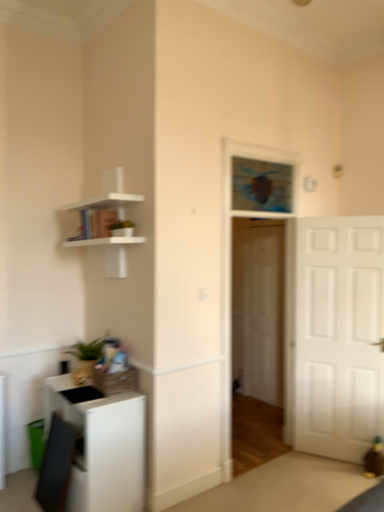
Question: Does white matte shelf at upper left have a lesser height compared to blue glass window at center?

Choices:
 (A) no
 (B) yes

Answer: (A)

Question: From the image's perspective, is white matte shelf at upper left under blue glass window at center?

Choices:
 (A) no
 (B) yes

Answer: (B)

Question: Does white matte shelf at upper left have a lesser width compared to blue glass window at center?

Choices:
 (A) no
 (B) yes

Answer: (A)

Question: Is blue glass window at center inside white matte shelf at upper left?

Choices:
 (A) yes
 (B) no

Answer: (B)

Question: Is white matte shelf at upper left looking in the opposite direction of blue glass window at center?

Choices:
 (A) yes
 (B) no

Answer: (A)

Question: Is point (347, 237) closer or farther from the camera than point (276, 378)?

Choices:
 (A) closer
 (B) farther

Answer: (A)

Question: Considering the positions of white matte door at right, acting as the 1th door starting from the front, and white wooden door at center, which is the 2th door from front to back, in the image, is white matte door at right, acting as the 1th door starting from the front, taller or shorter than white wooden door at center, which is the 2th door from front to back,?

Choices:
 (A) tall
 (B) short

Answer: (B)

Question: Considering their positions, is white matte door at right, which is the second door in back-to-front order, located in front of or behind white wooden door at center, which is the first door from back to front?

Choices:
 (A) behind
 (B) front

Answer: (B)

Question: From a real-world perspective, is white matte door at right, acting as the 1th door starting from the front, positioned above or below white wooden door at center, which is the first door from back to front?

Choices:
 (A) above
 (B) below

Answer: (A)

Question: From a real-world perspective, is white matte cabinet at lower left above or below white matte door at right, acting as the 1th door starting from the front?

Choices:
 (A) above
 (B) below

Answer: (B)

Question: Is point (112, 507) closer or farther from the camera than point (352, 437)?

Choices:
 (A) closer
 (B) farther

Answer: (A)

Question: From their relative heights in the image, would you say white matte cabinet at lower left is taller or shorter than white matte door at right, acting as the 1th door starting from the front?

Choices:
 (A) tall
 (B) short

Answer: (B)

Question: In terms of size, does white matte cabinet at lower left appear bigger or smaller than white matte door at right, which is the second door in back-to-front order?

Choices:
 (A) big
 (B) small

Answer: (A)

Question: Is white wooden door at center, which is the 2th door from front to back, inside or outside of white matte cabinet at lower left?

Choices:
 (A) inside
 (B) outside

Answer: (B)

Question: In the image, is white wooden door at center, which is the 2th door from front to back, positioned in front of or behind white matte cabinet at lower left?

Choices:
 (A) front
 (B) behind

Answer: (B)